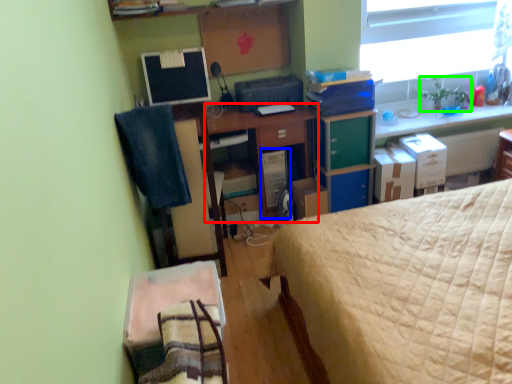
Question: Considering the real-world distances, which object is closest to desk (highlighted by a red box)? computer tower (highlighted by a blue box) or houseplant (highlighted by a green box).

Choices:
 (A) computer tower
 (B) houseplant

Answer: (A)